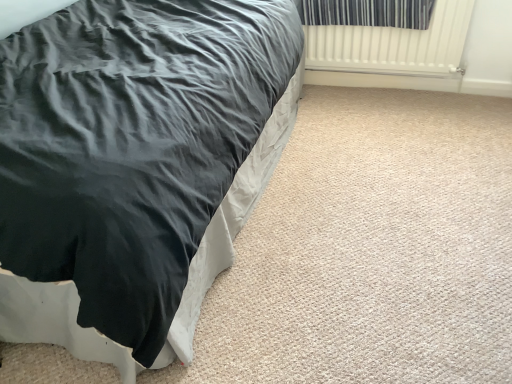
Question: Is black satin bed at left at the left side of striped fabric curtain at upper right?

Choices:
 (A) no
 (B) yes

Answer: (B)

Question: Does black satin bed at left have a greater width compared to striped fabric curtain at upper right?

Choices:
 (A) no
 (B) yes

Answer: (B)

Question: Considering the relative sizes of black satin bed at left and striped fabric curtain at upper right in the image provided, is black satin bed at left taller than striped fabric curtain at upper right?

Choices:
 (A) no
 (B) yes

Answer: (B)

Question: Considering the relative positions of black satin bed at left and striped fabric curtain at upper right in the image provided, is black satin bed at left to the right of striped fabric curtain at upper right from the viewer's perspective?

Choices:
 (A) yes
 (B) no

Answer: (B)

Question: Is black satin bed at left completely or partially outside of striped fabric curtain at upper right?

Choices:
 (A) no
 (B) yes

Answer: (B)

Question: From the image's perspective, is black satin bed at left above striped fabric curtain at upper right?

Choices:
 (A) no
 (B) yes

Answer: (A)

Question: Is black satin bed at left bigger than white ribbed radiator at upper right?

Choices:
 (A) yes
 (B) no

Answer: (A)

Question: Does black satin bed at left contain white ribbed radiator at upper right?

Choices:
 (A) yes
 (B) no

Answer: (B)

Question: Does black satin bed at left have a greater width compared to white ribbed radiator at upper right?

Choices:
 (A) no
 (B) yes

Answer: (B)

Question: Are black satin bed at left and white ribbed radiator at upper right far apart?

Choices:
 (A) no
 (B) yes

Answer: (B)

Question: Is black satin bed at left taller than white ribbed radiator at upper right?

Choices:
 (A) no
 (B) yes

Answer: (B)

Question: From the image's perspective, does black satin bed at left appear lower than white ribbed radiator at upper right?

Choices:
 (A) no
 (B) yes

Answer: (B)

Question: From the image's perspective, does striped fabric curtain at upper right appear lower than black satin bed at left?

Choices:
 (A) no
 (B) yes

Answer: (A)